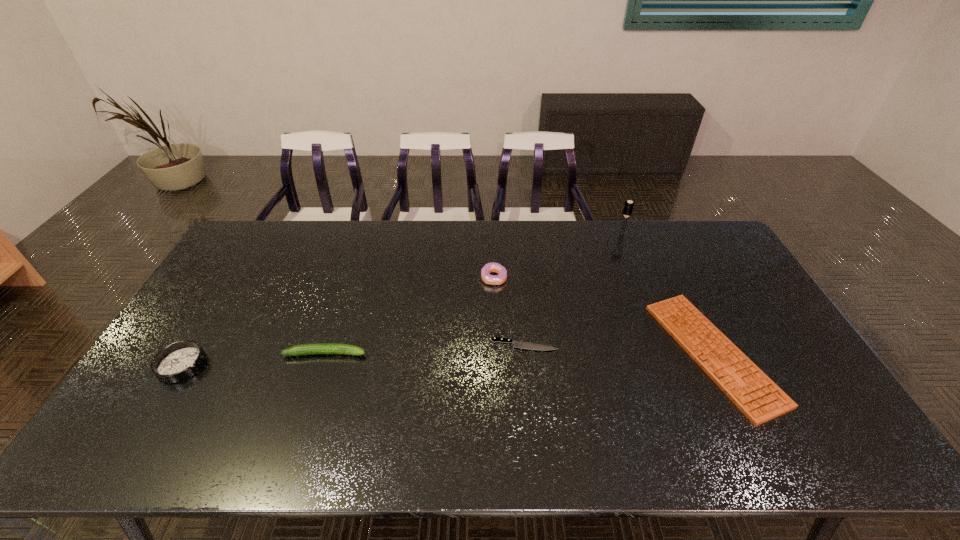
Identify the location of free point at the left edge. Image resolution: width=960 pixels, height=540 pixels. (184, 337).

You are a GUI agent. You are given a task and a screenshot of the screen. Output one action in this format:
    pyautogui.click(x=<x>, y=<y>)
    Task: Click on the vacant space at the right edge of the desktop
    
    Given the screenshot: What is the action you would take?
    point(730,279)

Where is `vacant space at the far left corner of the desktop`? The width and height of the screenshot is (960, 540). vacant space at the far left corner of the desktop is located at coordinates (251, 235).

Locate an element on the screen. free space between the second shortest object and the zucchini is located at coordinates (519, 353).

At what (x,y) coordinates should I click in order to perform the action: click on free spot between the ashtray and the second farthest object. Please return your answer as a coordinate pair (x, y). The height and width of the screenshot is (540, 960). Looking at the image, I should click on (338, 321).

The image size is (960, 540). Find the location of `vacant area between the second object from left to right and the shortest object`. vacant area between the second object from left to right and the shortest object is located at coordinates (425, 349).

Find the location of `free space between the ashtray and the tallest object`. free space between the ashtray and the tallest object is located at coordinates (402, 299).

Locate an element on the screen. This screenshot has height=540, width=960. blank region between the fifth nearest object and the computer keyboard is located at coordinates (604, 316).

Where is `vacant point located between the computer keyboard and the zucchini`? This screenshot has width=960, height=540. vacant point located between the computer keyboard and the zucchini is located at coordinates (519, 353).

Where is `free space between the leftmost object and the shortest object`? The image size is (960, 540). free space between the leftmost object and the shortest object is located at coordinates (353, 355).